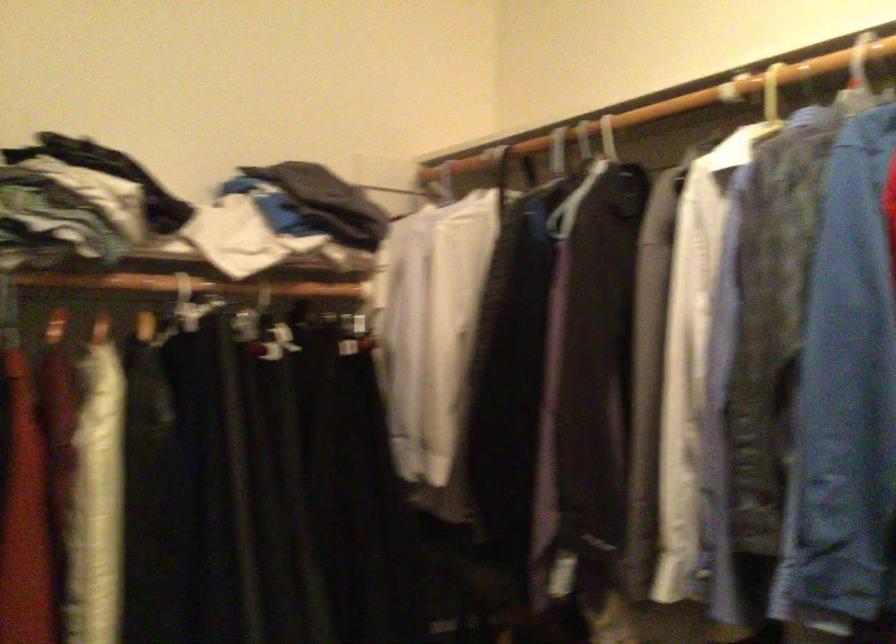
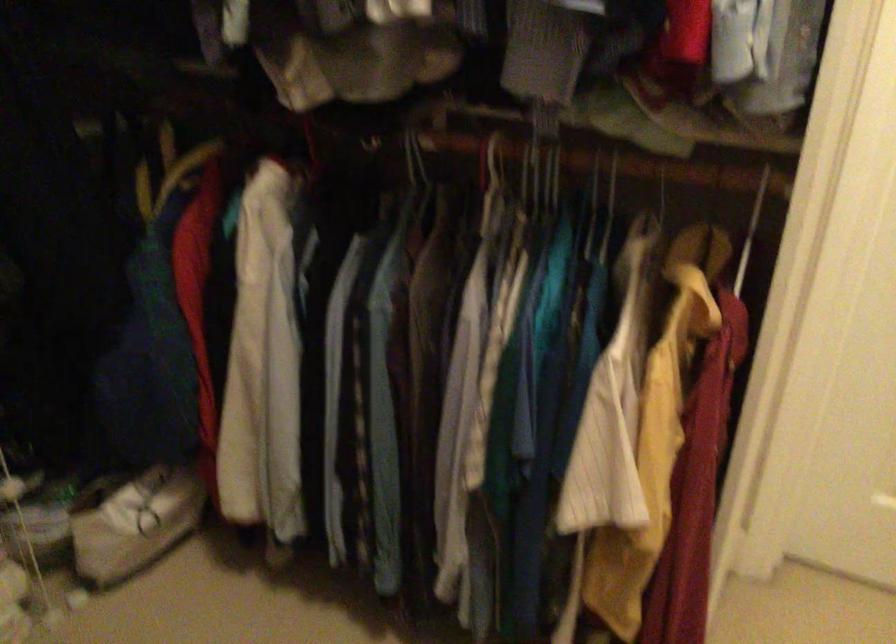
How did the camera likely rotate?

The camera's rotation is toward right-down.